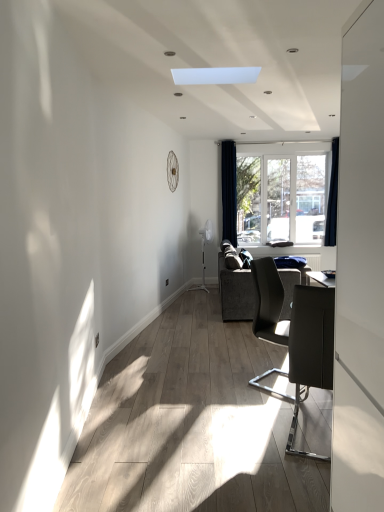
You are a GUI agent. You are given a task and a screenshot of the screen. Output one action in this format:
    pyautogui.click(x=<x>, y=<y>)
    Task: Click on the vacant space situated on the left part of matte black chair at right, the 1th chair positioned from the front
    This screenshot has height=512, width=384.
    Given the screenshot: What is the action you would take?
    pyautogui.click(x=246, y=432)